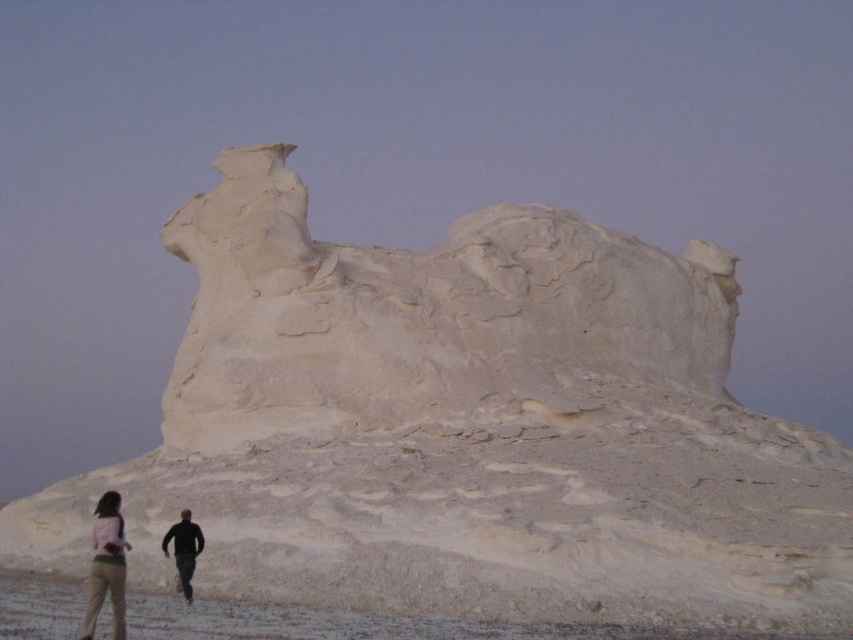
Question: Can you confirm if white sandstone rock at center is smaller than matte pink shirt at lower left?

Choices:
 (A) no
 (B) yes

Answer: (A)

Question: Considering the real-world distances, which object is farthest from the matte pink shirt at lower left?

Choices:
 (A) black matte man at lower left
 (B) light pink fabric pants at lower left

Answer: (A)

Question: Does white sandstone rock at center have a smaller size compared to black matte man at lower left?

Choices:
 (A) yes
 (B) no

Answer: (B)

Question: Considering the real-world distances, which object is farthest from the matte pink shirt at lower left?

Choices:
 (A) white sandstone rock at center
 (B) light pink fabric pants at lower left

Answer: (A)

Question: Can you confirm if white sandstone rock at center is smaller than black matte man at lower left?

Choices:
 (A) no
 (B) yes

Answer: (A)

Question: Which of these objects is positioned closest to the black matte man at lower left?

Choices:
 (A) light pink fabric pants at lower left
 (B) matte pink shirt at lower left
 (C) white sandstone rock at center

Answer: (A)